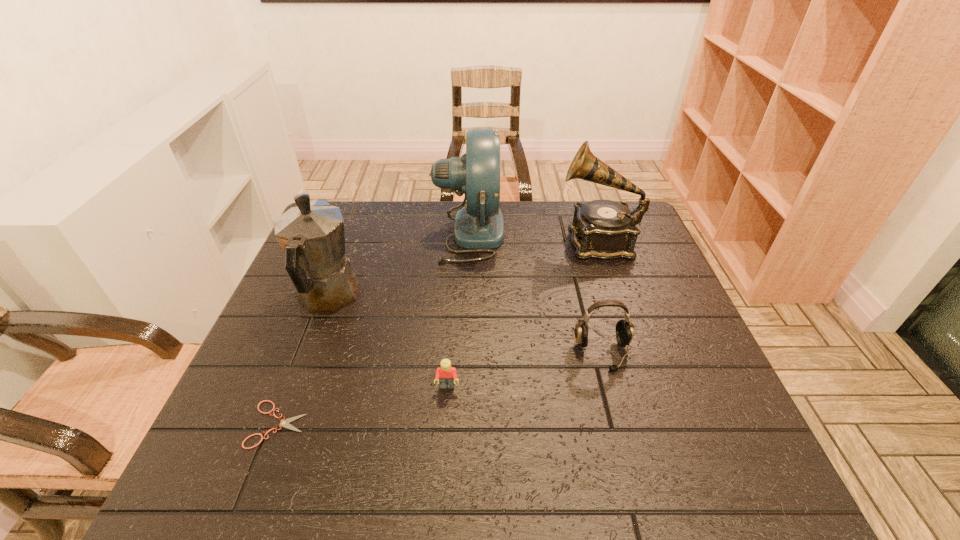
Identify the location of coffeepot that is at the left edge. The height and width of the screenshot is (540, 960). (312, 235).

Locate an element on the screen. This screenshot has width=960, height=540. shears at the left edge is located at coordinates (284, 423).

Identify the location of object located at the right edge. (604, 229).

Identify the location of object that is at the far right corner. (604, 229).

The image size is (960, 540). Identify the location of vacant space at the far edge of the desktop. (445, 235).

The height and width of the screenshot is (540, 960). I want to click on vacant space at the right edge, so 618,274.

Locate an element on the screen. Image resolution: width=960 pixels, height=540 pixels. vacant space at the far left corner of the desktop is located at coordinates (357, 240).

Where is `blank area at the near left corner`? This screenshot has height=540, width=960. blank area at the near left corner is located at coordinates (249, 497).

In the image, there is a desktop. At what (x,y) coordinates should I click in order to perform the action: click on free space at the near right corner. Please return your answer as a coordinate pair (x, y). Looking at the image, I should click on (745, 498).

Locate an element on the screen. free point between the headset and the second nearest object is located at coordinates (525, 370).